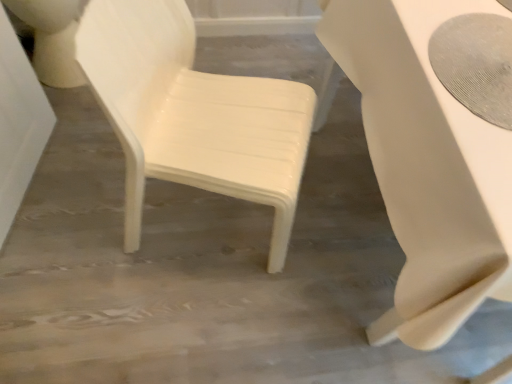
Question: Is white glossy toilet bowl at upper left inside the boundaries of white glossy table at right, or outside?

Choices:
 (A) outside
 (B) inside

Answer: (A)

Question: From their relative heights in the image, would you say white glossy toilet bowl at upper left is taller or shorter than white glossy table at right?

Choices:
 (A) short
 (B) tall

Answer: (A)

Question: Which is farther from the white glossy toilet bowl at upper left?

Choices:
 (A) white glossy table at right
 (B) white glossy chair at center

Answer: (A)

Question: Which is farther from the white glossy table at right?

Choices:
 (A) white glossy chair at center
 (B) white glossy toilet bowl at upper left

Answer: (B)